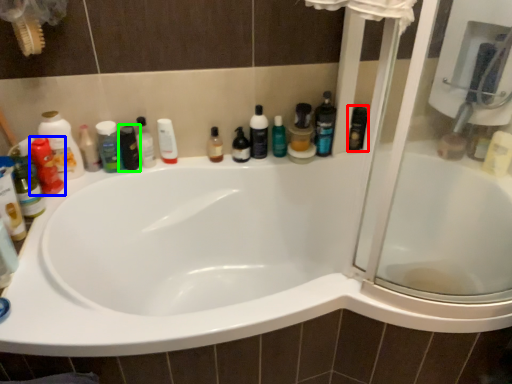
Question: Which object is positioned closest to toiletry (highlighted by a red box)? Select from toiletry (highlighted by a blue box) and mouthwash (highlighted by a green box).

Choices:
 (A) toiletry
 (B) mouthwash

Answer: (B)